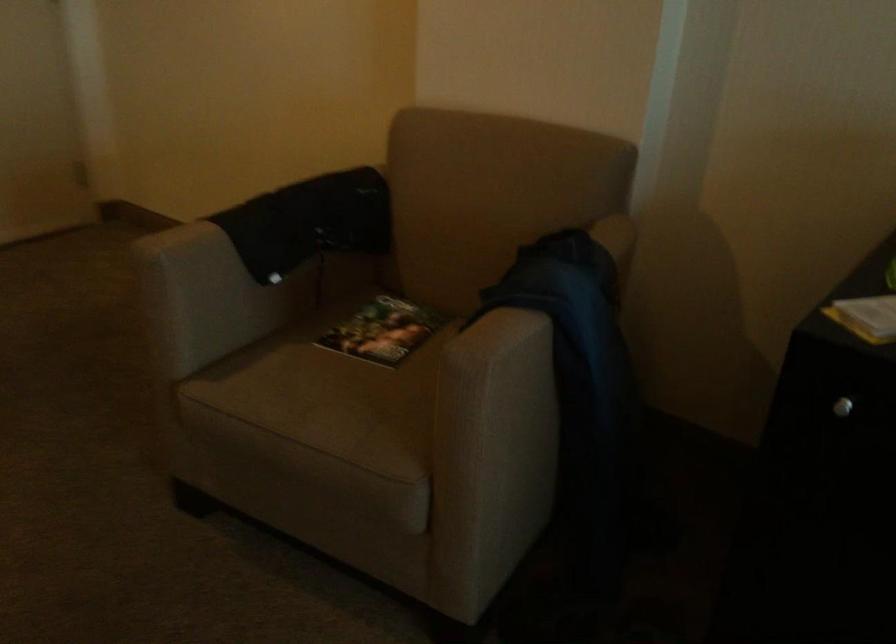
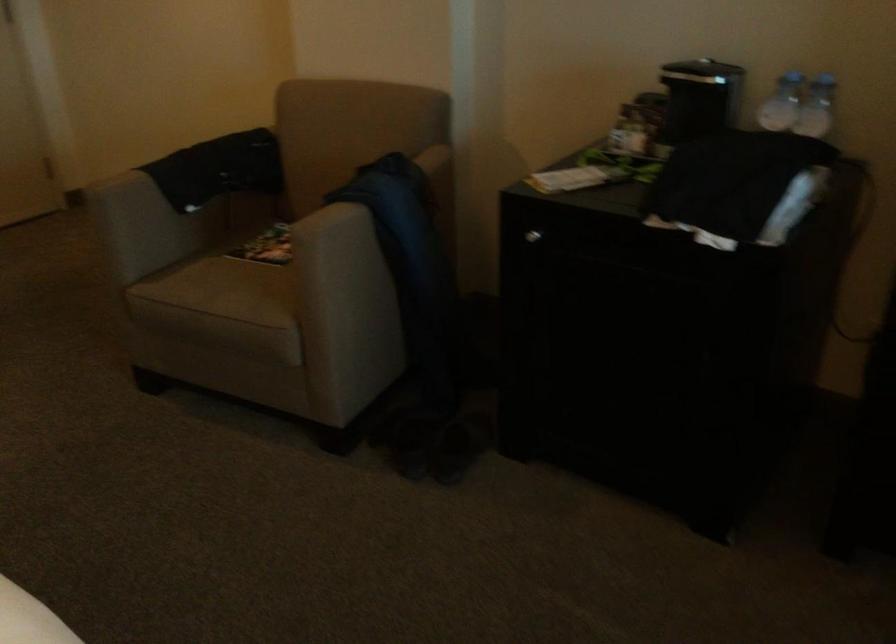
In a continuous first-person perspective shot, in which direction is the camera moving?

The movement direction of the cameraman is right, backward.